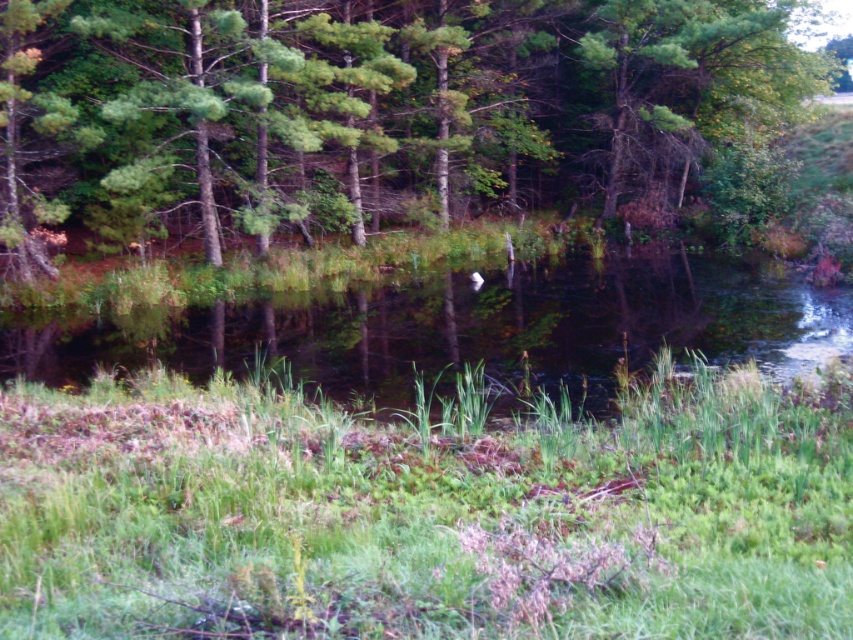
Question: Is green leafy tree at center below green grassy water at center?

Choices:
 (A) no
 (B) yes

Answer: (A)

Question: Among these points, which one is farthest from the camera?

Choices:
 (A) (425, 317)
 (B) (468, 148)

Answer: (B)

Question: Is green leafy tree at center above green grassy water at center?

Choices:
 (A) no
 (B) yes

Answer: (B)

Question: Is green leafy tree at center bigger than green grassy water at center?

Choices:
 (A) no
 (B) yes

Answer: (B)

Question: Among these objects, which one is farthest from the camera?

Choices:
 (A) green leafy tree at center
 (B) green grassy water at center

Answer: (A)